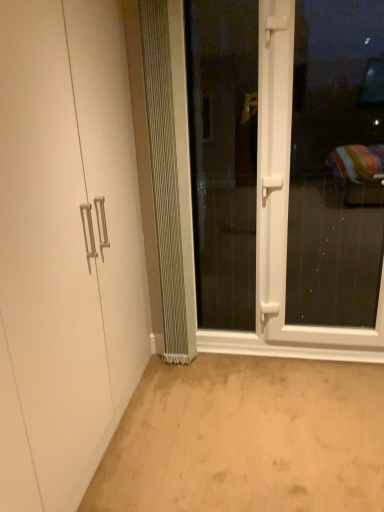
Question: Which direction should I rotate to face clear glass screen door at center, which is the 2th screen door in right-to-left order, — up or down?

Choices:
 (A) down
 (B) up

Answer: (B)

Question: Considering the relative sizes of white matte cabinet at left and white plastic screen door at center, which is the first screen door from right to left, in the image provided, is white matte cabinet at left shorter than white plastic screen door at center, which is the first screen door from right to left,?

Choices:
 (A) yes
 (B) no

Answer: (B)

Question: From the image's perspective, is white matte cabinet at left on white plastic screen door at center, the 2th screen door from the left?

Choices:
 (A) no
 (B) yes

Answer: (A)

Question: Does white matte cabinet at left lie in front of white plastic screen door at center, which is the first screen door from right to left?

Choices:
 (A) yes
 (B) no

Answer: (A)

Question: Is white matte cabinet at left to the left of white plastic screen door at center, the 2th screen door from the left, from the viewer's perspective?

Choices:
 (A) no
 (B) yes

Answer: (B)

Question: Is white plastic screen door at center, which is the first screen door from right to left, a part of white matte cabinet at left?

Choices:
 (A) yes
 (B) no

Answer: (B)

Question: Is white matte cabinet at left outside white plastic screen door at center, the 2th screen door from the left?

Choices:
 (A) no
 (B) yes

Answer: (B)

Question: Is the depth of beige carpet at lower center greater than that of clear glass screen door at center, which is the 2th screen door in right-to-left order?

Choices:
 (A) yes
 (B) no

Answer: (B)

Question: Is beige carpet at lower center surrounding clear glass screen door at center, which is the 2th screen door in right-to-left order?

Choices:
 (A) no
 (B) yes

Answer: (A)

Question: Does beige carpet at lower center turn towards clear glass screen door at center, which ranks as the 1th screen door in left-to-right order?

Choices:
 (A) yes
 (B) no

Answer: (B)

Question: Is beige carpet at lower center closer to the viewer compared to clear glass screen door at center, which ranks as the 1th screen door in left-to-right order?

Choices:
 (A) yes
 (B) no

Answer: (A)

Question: Can you confirm if beige carpet at lower center is thinner than clear glass screen door at center, which ranks as the 1th screen door in left-to-right order?

Choices:
 (A) no
 (B) yes

Answer: (A)

Question: From the image's perspective, would you say beige carpet at lower center is shown under clear glass screen door at center, which is the 2th screen door in right-to-left order?

Choices:
 (A) no
 (B) yes

Answer: (B)

Question: Does white plastic screen door at center, the 2th screen door from the left, lie in front of metallic silver radiator at center?

Choices:
 (A) yes
 (B) no

Answer: (A)